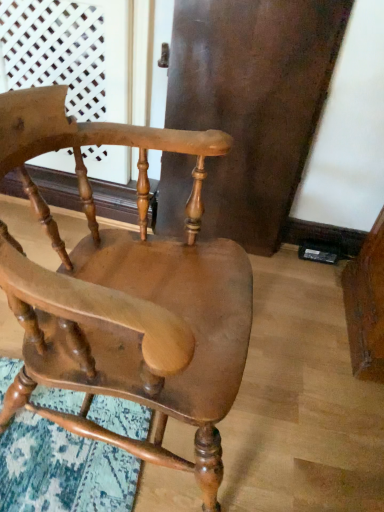
Where is `shiny brown wood chair at center`? This screenshot has height=512, width=384. shiny brown wood chair at center is located at coordinates [x=126, y=296].

What do you see at coordinates (126, 296) in the screenshot? Image resolution: width=384 pixels, height=512 pixels. I see `shiny brown wood chair at center` at bounding box center [126, 296].

Identify the location of shiny brown wood chair at center. (126, 296).